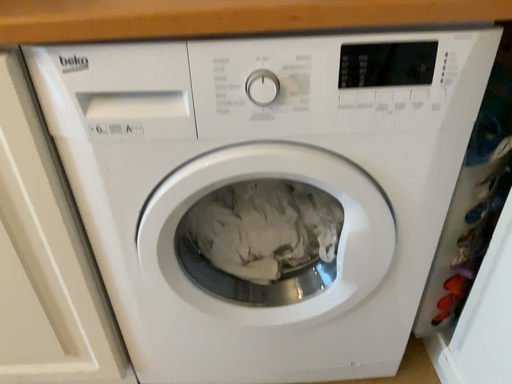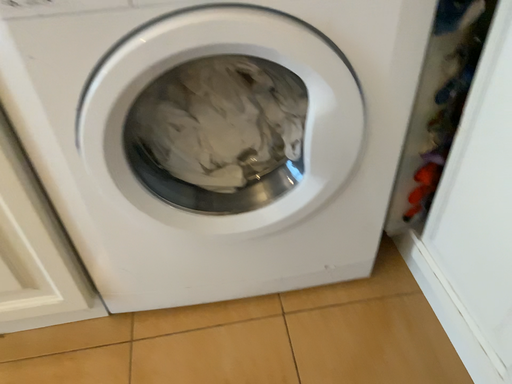
Question: Which way did the camera rotate in the video?

Choices:
 (A) rotated downward
 (B) rotated upward

Answer: (A)